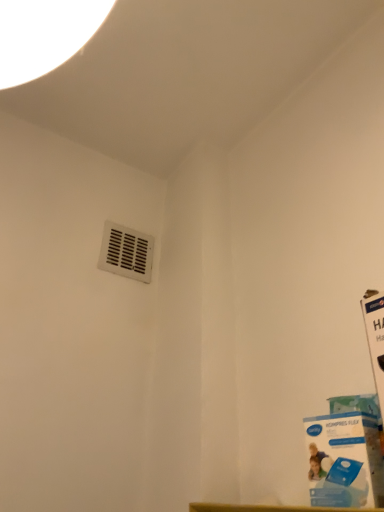
What do you see at coordinates (126, 252) in the screenshot? I see `white matte vent at upper center` at bounding box center [126, 252].

Identify the location of white matte vent at upper center. (126, 252).

Where is `white matte vent at upper center`? This screenshot has width=384, height=512. white matte vent at upper center is located at coordinates (126, 252).